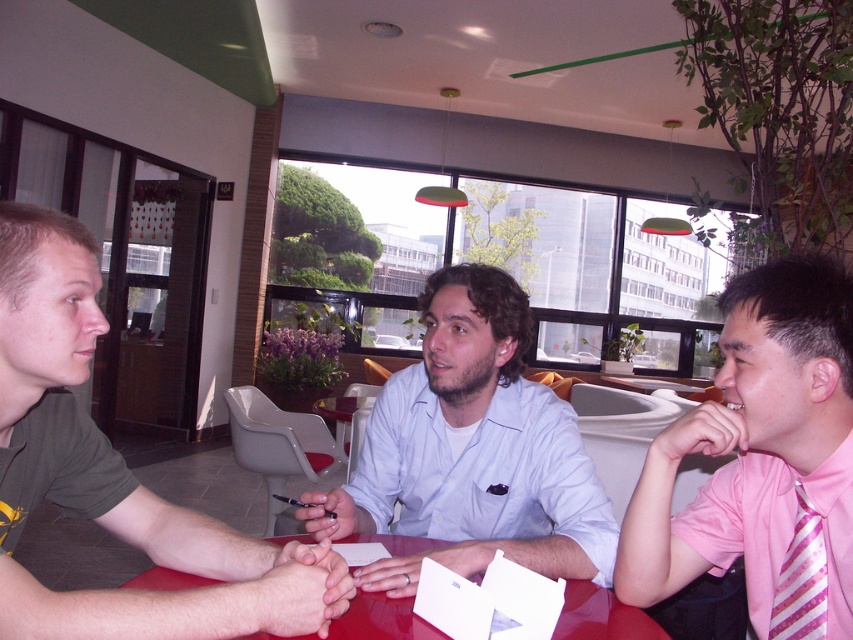
Who is shorter, pink striped tie at right or light blue shirt at center?

pink striped tie at right is shorter.

Is point (804, 476) closer to camera compared to point (523, 544)?

Yes, point (804, 476) is closer to viewer.

Who is more distant from viewer, (x=820, y=380) or (x=438, y=561)?

Point (x=438, y=561)

I want to click on pink striped tie at right, so pyautogui.click(x=761, y=460).

Is green matte shirt at left above smooth glossy table at center?

Yes.

Is green matte shirt at left closer to camera compared to smooth glossy table at center?

Yes, it is in front of smooth glossy table at center.

This screenshot has height=640, width=853. I want to click on green matte shirt at left, so click(115, 474).

Does pink striped tie at right come in front of smooth glossy table at center?

No, pink striped tie at right is behind smooth glossy table at center.

Is pink striped tie at right below smooth glossy table at center?

Incorrect, pink striped tie at right is not positioned below smooth glossy table at center.

Find the location of a particular element. The width and height of the screenshot is (853, 640). pink striped tie at right is located at coordinates (761, 460).